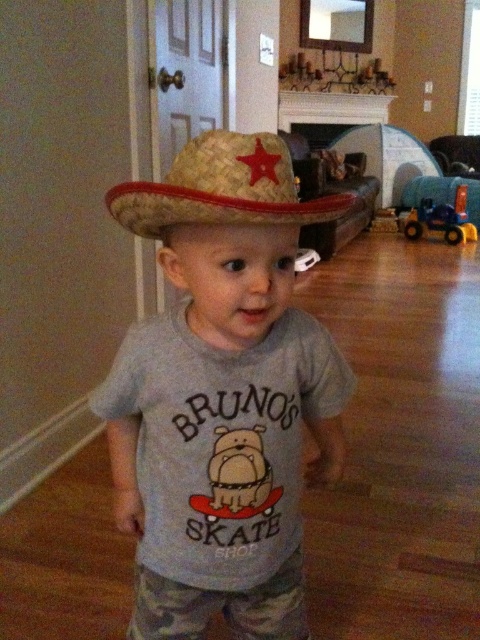
Question: In this image, where is straw hat at center located relative to strawmaterial/texturecowboy hat at upper center?

Choices:
 (A) right
 (B) left

Answer: (A)

Question: Which point is farther to the camera?

Choices:
 (A) (223, 172)
 (B) (284, 145)

Answer: (B)

Question: Can you confirm if straw hat at center is wider than strawmaterial/texturecowboy hat at upper center?

Choices:
 (A) yes
 (B) no

Answer: (A)

Question: Which object appears farthest from the camera in this image?

Choices:
 (A) strawmaterial/texturecowboy hat at upper center
 (B) straw hat at center

Answer: (A)

Question: Is straw hat at center to the right of strawmaterial/texturecowboy hat at upper center from the viewer's perspective?

Choices:
 (A) yes
 (B) no

Answer: (A)

Question: Among these points, which one is farthest from the camera?

Choices:
 (A) (307, 632)
 (B) (238, 179)

Answer: (A)